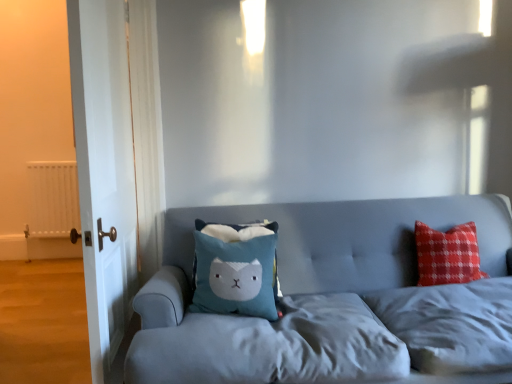
Question: Can you confirm if white wood door at left is thinner than white matte radiator at left?

Choices:
 (A) yes
 (B) no

Answer: (B)

Question: Does white wood door at left have a larger size compared to white matte radiator at left?

Choices:
 (A) yes
 (B) no

Answer: (A)

Question: From the image's perspective, does white wood door at left appear higher than white matte radiator at left?

Choices:
 (A) no
 (B) yes

Answer: (B)

Question: From a real-world perspective, does white wood door at left sit lower than white matte radiator at left?

Choices:
 (A) no
 (B) yes

Answer: (A)

Question: Considering the relative positions of white wood door at left and white matte radiator at left in the image provided, is white wood door at left to the right of white matte radiator at left from the viewer's perspective?

Choices:
 (A) yes
 (B) no

Answer: (A)

Question: From the image's perspective, relative to velvet blue couch at center, is white matte radiator at left above or below?

Choices:
 (A) above
 (B) below

Answer: (A)

Question: Based on their positions, is white matte radiator at left located to the left or right of velvet blue couch at center?

Choices:
 (A) left
 (B) right

Answer: (A)

Question: In terms of height, does white matte radiator at left look taller or shorter compared to velvet blue couch at center?

Choices:
 (A) short
 (B) tall

Answer: (B)

Question: Considering the positions of white matte radiator at left and velvet blue couch at center in the image, is white matte radiator at left wider or thinner than velvet blue couch at center?

Choices:
 (A) thin
 (B) wide

Answer: (A)

Question: Do you think white matte radiator at left is within white wood door at left, or outside of it?

Choices:
 (A) inside
 (B) outside

Answer: (B)

Question: From the image's perspective, is white matte radiator at left above or below white wood door at left?

Choices:
 (A) below
 (B) above

Answer: (A)

Question: Is point (51, 196) positioned closer to the camera than point (124, 165)?

Choices:
 (A) closer
 (B) farther

Answer: (B)

Question: From a real-world perspective, relative to white wood door at left, is white matte radiator at left vertically above or below?

Choices:
 (A) above
 (B) below

Answer: (B)

Question: Looking at the image, does white matte radiator at left seem bigger or smaller compared to blue plush pillow at center?

Choices:
 (A) small
 (B) big

Answer: (B)

Question: Does point (74, 221) appear closer or farther from the camera than point (241, 228)?

Choices:
 (A) farther
 (B) closer

Answer: (A)